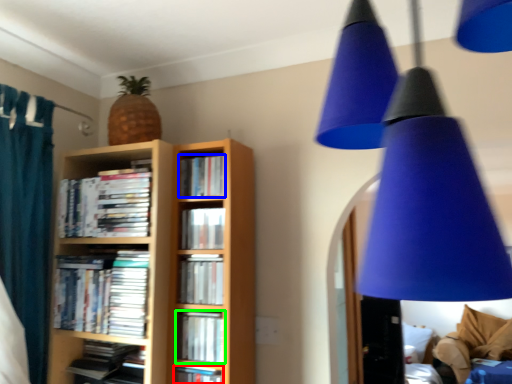
Question: Which object is positioned closest to book (highlighted by a red box)? Select from book (highlighted by a blue box) and book (highlighted by a green box).

Choices:
 (A) book
 (B) book

Answer: (B)